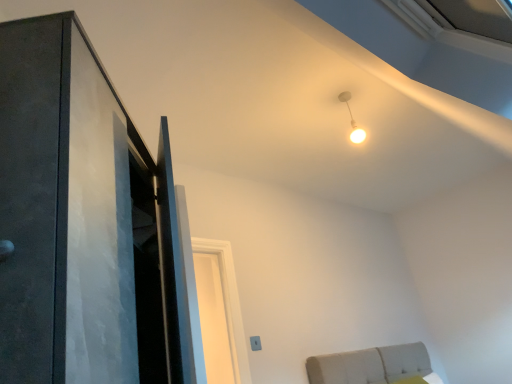
In order to face white glossy light bulb at upper center, should I rotate leftwards or rightwards?

To face it directly, rotate right by 13.039 degrees.

Where is `white glossy light bulb at upper center`? The height and width of the screenshot is (384, 512). white glossy light bulb at upper center is located at coordinates pyautogui.click(x=352, y=121).

Describe the element at coordinates (352, 121) in the screenshot. I see `white glossy light bulb at upper center` at that location.

Describe the element at coordinates (83, 222) in the screenshot. I see `matte black door at left` at that location.

Locate an element on the screen. This screenshot has width=512, height=384. matte black door at left is located at coordinates (83, 222).

Locate an element on the screen. white glossy light bulb at upper center is located at coordinates (352, 121).

Is white glossy light bulb at upper center at the left side of matte black door at left?

In fact, white glossy light bulb at upper center is to the right of matte black door at left.

Considering the relative positions of white glossy light bulb at upper center and matte black door at left in the image provided, is white glossy light bulb at upper center behind matte black door at left?

Yes, white glossy light bulb at upper center is further from the camera.

Which point is more forward, (352, 128) or (44, 106)?

The point (44, 106) is in front.

From the image's perspective, which one is positioned lower, white glossy light bulb at upper center or matte black door at left?

matte black door at left.

From a real-world perspective, does white glossy light bulb at upper center stand above matte black door at left?

Indeed, from a real-world perspective, white glossy light bulb at upper center stands above matte black door at left.

Considering the relative sizes of white glossy light bulb at upper center and matte black door at left in the image provided, is white glossy light bulb at upper center wider than matte black door at left?

In fact, white glossy light bulb at upper center might be narrower than matte black door at left.

Considering the relative sizes of white glossy light bulb at upper center and matte black door at left in the image provided, is white glossy light bulb at upper center taller than matte black door at left?

In fact, white glossy light bulb at upper center may be shorter than matte black door at left.

Which of these two, white glossy light bulb at upper center or matte black door at left, is smaller?

Smaller between the two is white glossy light bulb at upper center.

Is white glossy light bulb at upper center positioned beyond the bounds of matte black door at left?

That's correct, white glossy light bulb at upper center is outside of matte black door at left.

Are white glossy light bulb at upper center and matte black door at left beside each other?

white glossy light bulb at upper center and matte black door at left are not in contact.

Is white glossy light bulb at upper center aimed at matte black door at left?

Yes, white glossy light bulb at upper center is turned towards matte black door at left.

Consider the image. What's the angular difference between white glossy light bulb at upper center and matte black door at left's facing directions?

The angle between the facing direction of white glossy light bulb at upper center and the facing direction of matte black door at left is 135 degrees.

Find the location of `door located on the left of white glossy light bulb at upper center`. door located on the left of white glossy light bulb at upper center is located at coordinates (83, 222).

Considering the relative positions of matte black door at left and white glossy light bulb at upper center in the image provided, is matte black door at left to the right of white glossy light bulb at upper center from the viewer's perspective?

No, matte black door at left is not to the right of white glossy light bulb at upper center.

Does matte black door at left lie in front of white glossy light bulb at upper center?

Yes, matte black door at left is closer to the viewer.

Which point is more forward, (x=48, y=128) or (x=358, y=129)?

The point (x=48, y=128) is in front.

From the image's perspective, between matte black door at left and white glossy light bulb at upper center, who is located below?

matte black door at left is shown below in the image.

From a real-world perspective, relative to white glossy light bulb at upper center, is matte black door at left vertically above or below?

matte black door at left is situated lower than white glossy light bulb at upper center in the real world.

In terms of width, does matte black door at left look wider or thinner when compared to white glossy light bulb at upper center?

In the image, matte black door at left appears to be wider than white glossy light bulb at upper center.

Considering the sizes of matte black door at left and white glossy light bulb at upper center in the image, is matte black door at left taller or shorter than white glossy light bulb at upper center?

In the image, matte black door at left appears to be taller than white glossy light bulb at upper center.

Considering the relative sizes of matte black door at left and white glossy light bulb at upper center in the image provided, is matte black door at left bigger than white glossy light bulb at upper center?

Yes, matte black door at left is bigger than white glossy light bulb at upper center.

Is matte black door at left outside of white glossy light bulb at upper center?

matte black door at left lies outside white glossy light bulb at upper center's area.

Is matte black door at left directly adjacent to white glossy light bulb at upper center?

No, matte black door at left is not beside white glossy light bulb at upper center.

Is matte black door at left facing away from white glossy light bulb at upper center?

No, matte black door at left is not facing the opposite direction of white glossy light bulb at upper center.

Can you tell me how much matte black door at left and white glossy light bulb at upper center differ in facing direction?

There is a 135-degree angle between the facing directions of matte black door at left and white glossy light bulb at upper center.

Locate an element on the screen. This screenshot has width=512, height=384. light positioned vertically above the matte black door at left (from a real-world perspective) is located at coordinates (352, 121).

Where is `light on the right of matte black door at left`? Image resolution: width=512 pixels, height=384 pixels. light on the right of matte black door at left is located at coordinates (352, 121).

The image size is (512, 384). Find the location of `door located on the left of white glossy light bulb at upper center`. door located on the left of white glossy light bulb at upper center is located at coordinates (83, 222).